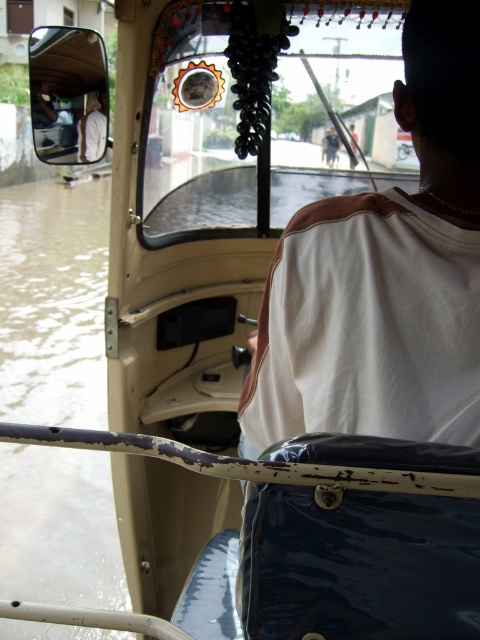
You are a passenger in the tuk tuk and need to reach an item behind you. Which object, the white fabric shirt at left or the dark brown leather jacket at upper center, is shorter and therefore easier to duck under?

The white fabric shirt at left has a lesser height compared to the dark brown leather jacket at upper center, so it is shorter and easier to duck under.

You are a passenger in the flooded street tuk tuk and you want to know if your backpack can fit between the white fabric shirt at left and the dark brown leather jacket at upper center. The backpack is 40 cm wide. Can it fit?

Result: The white fabric shirt at left might be wider than dark brown leather jacket at upper center, but the exact width difference isn not specified. Without knowing the actual width of the space between them, it is uncertain if the backpack will fit.